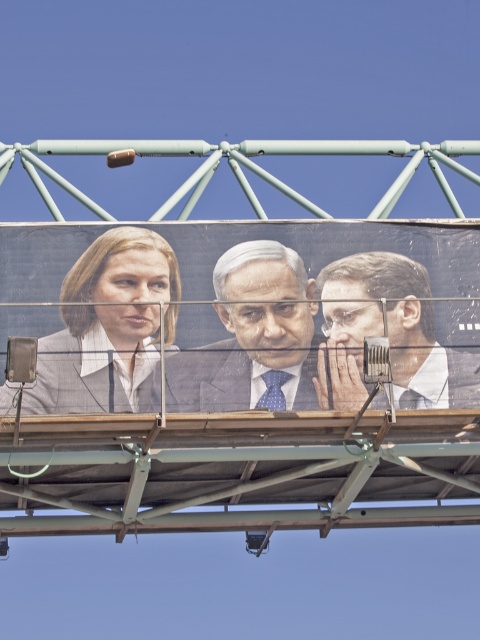
Question: Is the position of blue dotted tie at center less distant than that of dark blue textured suit at center?

Choices:
 (A) no
 (B) yes

Answer: (B)

Question: Is matte gray suit at center bigger than dark blue textured suit at center?

Choices:
 (A) yes
 (B) no

Answer: (A)

Question: Is blue dotted tie at center thinner than dark blue textured suit at center?

Choices:
 (A) yes
 (B) no

Answer: (B)

Question: Which of the following is the farthest from the observer?

Choices:
 (A) smooth gray suit at center
 (B) matte gray suit at center
 (C) blue dotted tie at center

Answer: (A)

Question: Which of the following is the closest to the observer?

Choices:
 (A) (172, 252)
 (B) (111, 244)
 (C) (214, 390)

Answer: (C)

Question: Among these points, which one is farthest from the camera?

Choices:
 (A) (154, 268)
 (B) (300, 237)
 (C) (240, 371)
 (D) (156, 378)

Answer: (B)